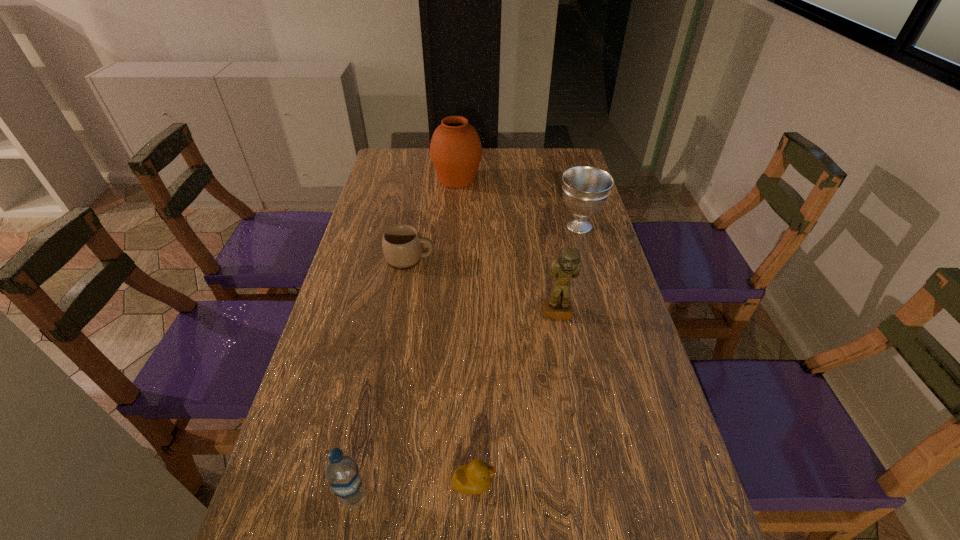
Find the location of a particular element. free region at the right edge of the desktop is located at coordinates (614, 412).

This screenshot has height=540, width=960. I want to click on free space at the far left corner, so click(398, 169).

Where is `free spot at the far right corner of the desktop`? The height and width of the screenshot is (540, 960). free spot at the far right corner of the desktop is located at coordinates (568, 158).

The height and width of the screenshot is (540, 960). Identify the location of vacant region between the duckling and the water bottle. (414, 490).

Where is `free space between the figurine and the second shortest object`? free space between the figurine and the second shortest object is located at coordinates (484, 286).

Locate an element on the screen. The image size is (960, 540). unoccupied area between the water bottle and the fourth nearest object is located at coordinates (382, 377).

Find the location of a particular element. free space between the shortest object and the rightmost object is located at coordinates coord(526,355).

You are a GUI agent. You are given a task and a screenshot of the screen. Output one action in this format:
    pyautogui.click(x=<x>, y=<y>)
    Task: Click on the empty location between the water bottle and the duckling
    Image resolution: width=960 pixels, height=540 pixels.
    Given the screenshot: What is the action you would take?
    coord(414,490)

The image size is (960, 540). I want to click on vacant area that lies between the mug and the water bottle, so click(x=382, y=377).

At what (x,y) coordinates should I click in order to perform the action: click on empty space between the water bottle and the figurine. Please return your answer as a coordinate pair (x, y). The width and height of the screenshot is (960, 540). Looking at the image, I should click on (456, 406).